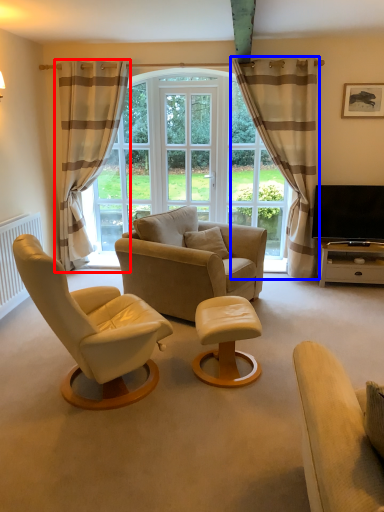
Question: Which of the following is the farthest to the observer, curtain (highlighted by a red box) or curtain (highlighted by a blue box)?

Choices:
 (A) curtain
 (B) curtain

Answer: (A)